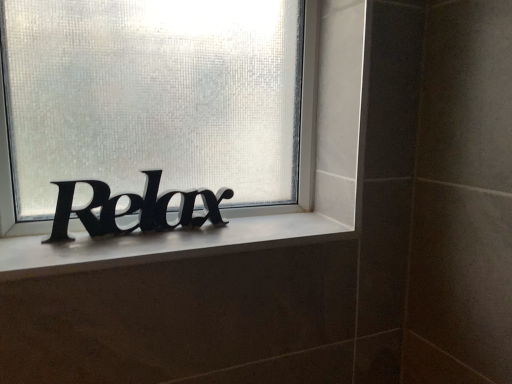
Question: Does white matte window sill at center have a greater height compared to black matte lettering at center?

Choices:
 (A) no
 (B) yes

Answer: (A)

Question: Is white matte window sill at center closer to the viewer compared to black matte lettering at center?

Choices:
 (A) yes
 (B) no

Answer: (A)

Question: Is white matte window sill at center positioned with its back to black matte lettering at center?

Choices:
 (A) yes
 (B) no

Answer: (B)

Question: From a real-world perspective, does white matte window sill at center sit lower than black matte lettering at center?

Choices:
 (A) yes
 (B) no

Answer: (A)

Question: Considering the relative sizes of white matte window sill at center and black matte lettering at center in the image provided, is white matte window sill at center thinner than black matte lettering at center?

Choices:
 (A) yes
 (B) no

Answer: (B)

Question: Considering their positions, is black matte lettering at center located in front of or behind black matte sign at center?

Choices:
 (A) front
 (B) behind

Answer: (B)

Question: In terms of height, does black matte lettering at center look taller or shorter compared to black matte sign at center?

Choices:
 (A) short
 (B) tall

Answer: (A)

Question: Is black matte lettering at center to the left or to the right of black matte sign at center in the image?

Choices:
 (A) right
 (B) left

Answer: (B)

Question: Is black matte lettering at center spatially inside black matte sign at center, or outside of it?

Choices:
 (A) outside
 (B) inside

Answer: (B)

Question: Is white matte window sill at center in front of or behind black matte sign at center in the image?

Choices:
 (A) front
 (B) behind

Answer: (A)

Question: From a real-world perspective, is white matte window sill at center above or below black matte sign at center?

Choices:
 (A) below
 (B) above

Answer: (A)

Question: From the image's perspective, is white matte window sill at center above or below black matte sign at center?

Choices:
 (A) below
 (B) above

Answer: (A)

Question: Is white matte window sill at center bigger or smaller than black matte sign at center?

Choices:
 (A) small
 (B) big

Answer: (A)

Question: In terms of size, does white matte window sill at center appear bigger or smaller than black matte lettering at center?

Choices:
 (A) small
 (B) big

Answer: (A)

Question: Is white matte window sill at center spatially inside black matte lettering at center, or outside of it?

Choices:
 (A) outside
 (B) inside

Answer: (A)